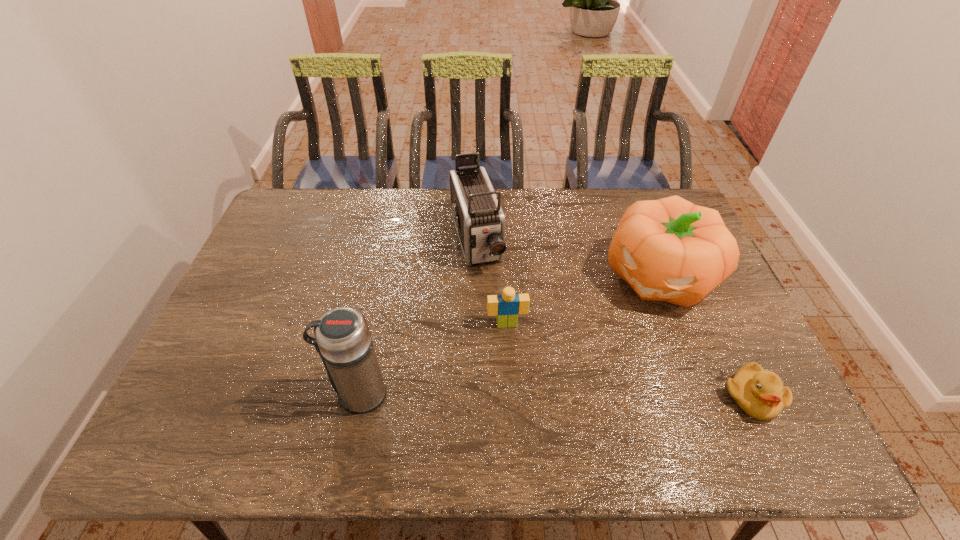
At what (x,y) coordinates should I click in order to perform the action: click on vacant space located 0.090m on the face of the second shortest object. Please return your answer as a coordinate pair (x, y). The image size is (960, 540). Looking at the image, I should click on (513, 357).

Find the location of `vacant region located at the lens of the camcorder`. vacant region located at the lens of the camcorder is located at coordinates (487, 293).

What are the coordinates of `vacant space located 0.080m at the lens of the camcorder` in the screenshot? It's located at (489, 298).

Where is `free space located 0.100m at the lens of the camcorder`? This screenshot has height=540, width=960. free space located 0.100m at the lens of the camcorder is located at coordinates (490, 303).

At what (x,y) coordinates should I click in order to perform the action: click on free location located on the carved face of the pumpkin. Please return your answer as a coordinate pair (x, y). This screenshot has height=540, width=960. Looking at the image, I should click on (579, 387).

Locate an element on the screen. The image size is (960, 540). free space located on the carved face of the pumpkin is located at coordinates (610, 345).

Identify the location of free space located on the carved face of the pumpkin. This screenshot has width=960, height=540. [x=604, y=352].

What are the coordinates of `object that is positioned at the far edge` in the screenshot? It's located at (479, 219).

Image resolution: width=960 pixels, height=540 pixels. In order to click on thermos bottle that is at the near edge in this screenshot , I will do `click(342, 338)`.

Locate an element on the screen. The image size is (960, 540). duckling that is positioned at the near edge is located at coordinates (760, 394).